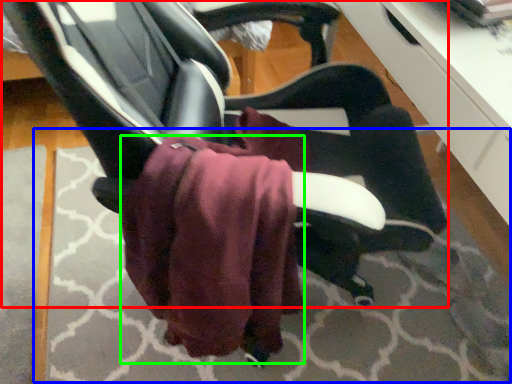
Question: Estimate the real-world distances between objects in this image. Which object is farther from chair (highlighted by a red box), mat (highlighted by a blue box) or bath towel (highlighted by a green box)?

Choices:
 (A) mat
 (B) bath towel

Answer: (A)